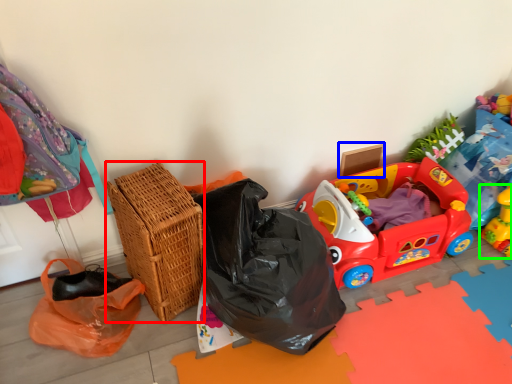
Question: Considering the real-world distances, which object is farthest from basket (highlighted by a red box)? cardboard box (highlighted by a blue box) or toy (highlighted by a green box)?

Choices:
 (A) cardboard box
 (B) toy

Answer: (B)